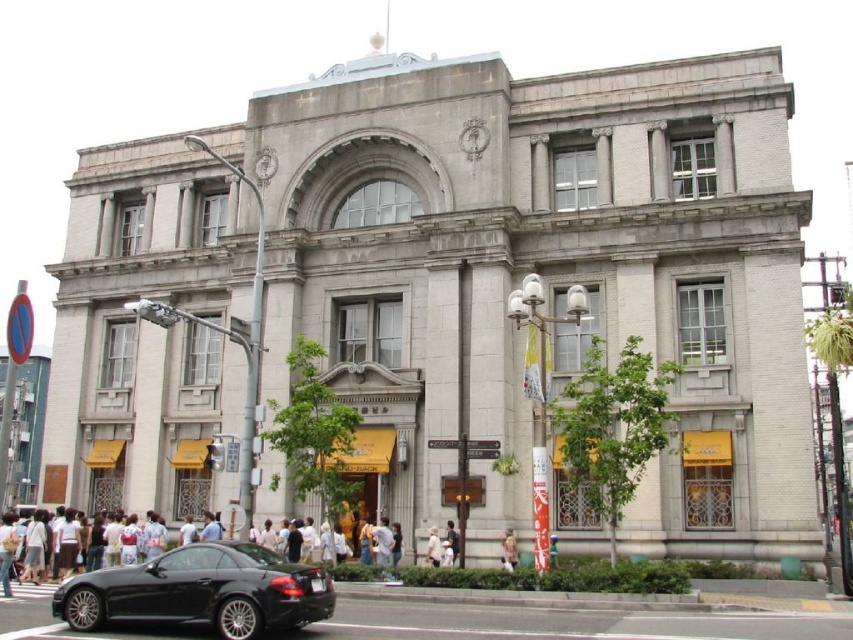
You are standing in front of the classical building and want to park your shiny black car at center in a spot that is exactly 1 meter away from the central arched window. Can you do that?

The 2D location of shiny black car at center is at point (201, 592), so yes, you can park it exactly 1 meter away from the central arched window.

You are standing in front of a classical building and notice a light brown fabric bag at lower center and a white cotton shirt at center. Which item is shorter in height?

The light brown fabric bag at lower center is shorter in height compared to the white cotton shirt at center.